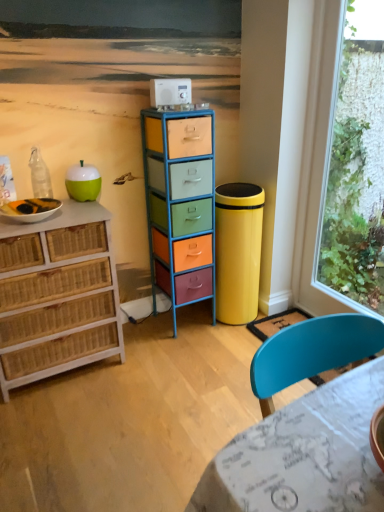
What is the approximate width of marble-patterned table at lower right?

marble-patterned table at lower right is 19.19 inches in width.

The image size is (384, 512). Describe the element at coordinates (303, 454) in the screenshot. I see `marble-patterned table at lower right` at that location.

What do you see at coordinates (180, 204) in the screenshot?
I see `metallic multicolored drawers at center, which is counted as the 2th chest of drawers, starting from the left` at bounding box center [180, 204].

This screenshot has width=384, height=512. Find the location of `transparent glass window at right`. transparent glass window at right is located at coordinates (346, 176).

Where is `green matte apple at left`? green matte apple at left is located at coordinates (83, 182).

The width and height of the screenshot is (384, 512). Identify the location of marble-patterned table at lower right. (303, 454).

Which of these two, metallic multicolored drawers at center, which is counted as the 2th chest of drawers, starting from the left, or marble-patterned table at lower right, stands shorter?

marble-patterned table at lower right.

Is metallic multicolored drawers at center, which is counted as the 2th chest of drawers, starting from the left, far from marble-patterned table at lower right?

metallic multicolored drawers at center, which is counted as the 2th chest of drawers, starting from the left, is far away from marble-patterned table at lower right.

Does metallic multicolored drawers at center, which is counted as the 2th chest of drawers, starting from the left, have a greater width compared to marble-patterned table at lower right?

In fact, metallic multicolored drawers at center, which is counted as the 2th chest of drawers, starting from the left, might be narrower than marble-patterned table at lower right.

From the image's perspective, is marble-patterned table at lower right located above woven wood chest of drawers at left, the 1th chest of drawers from the left?

No, from the image's perspective, marble-patterned table at lower right is not over woven wood chest of drawers at left, the 1th chest of drawers from the left.

Considering the sizes of objects marble-patterned table at lower right and woven wood chest of drawers at left, placed as the 2th chest of drawers when sorted from right to left, in the image provided, who is bigger, marble-patterned table at lower right or woven wood chest of drawers at left, placed as the 2th chest of drawers when sorted from right to left,?

Bigger between the two is woven wood chest of drawers at left, placed as the 2th chest of drawers when sorted from right to left.

Does marble-patterned table at lower right have a lesser width compared to woven wood chest of drawers at left, the 1th chest of drawers from the left?

Incorrect, the width of marble-patterned table at lower right is not less than that of woven wood chest of drawers at left, the 1th chest of drawers from the left.

You are a GUI agent. You are given a task and a screenshot of the screen. Output one action in this format:
    pyautogui.click(x=<x>, y=<y>)
    Task: Click on the 1st chest of drawers behind the marble-patterned table at lower right, counting from the anchor's position
    The height and width of the screenshot is (512, 384).
    Given the screenshot: What is the action you would take?
    pyautogui.click(x=57, y=295)

Is transparent glass window at right a part of white plastic appliance at upper center?

No, transparent glass window at right is not inside white plastic appliance at upper center.

Is white plastic appliance at upper center taller or shorter than transparent glass window at right?

white plastic appliance at upper center is shorter than transparent glass window at right.

Considering the positions of point (171, 91) and point (328, 242), is point (171, 91) closer or farther from the camera than point (328, 242)?

Point (171, 91) is closer to the camera than point (328, 242).

Between white plastic appliance at upper center and transparent glass window at right, which one has larger size?

transparent glass window at right.

Can you confirm if woven wood chest of drawers at left, the 1th chest of drawers from the left, is shorter than green matte apple at left?

No, woven wood chest of drawers at left, the 1th chest of drawers from the left, is not shorter than green matte apple at left.

Is point (47, 344) behind point (80, 174)?

No.

Considering the sizes of objects woven wood chest of drawers at left, the 1th chest of drawers from the left, and green matte apple at left in the image provided, who is smaller, woven wood chest of drawers at left, the 1th chest of drawers from the left, or green matte apple at left?

With smaller size is green matte apple at left.

From a real-world perspective, is woven wood chest of drawers at left, placed as the 2th chest of drawers when sorted from right to left, below green matte apple at left?

Indeed, from a real-world perspective, woven wood chest of drawers at left, placed as the 2th chest of drawers when sorted from right to left, is positioned beneath green matte apple at left.

From the image's perspective, is white plastic appliance at upper center located above woven wood chest of drawers at left, the 1th chest of drawers from the left?

Yes, from the image's perspective, white plastic appliance at upper center is above woven wood chest of drawers at left, the 1th chest of drawers from the left.

In the scene shown: Is woven wood chest of drawers at left, the 1th chest of drawers from the left, at the back of white plastic appliance at upper center?

No.

Is white plastic appliance at upper center inside the boundaries of woven wood chest of drawers at left, the 1th chest of drawers from the left, or outside?

white plastic appliance at upper center is located beyond the bounds of woven wood chest of drawers at left, the 1th chest of drawers from the left.

Identify the location of appliance on the right of the woven wood chest of drawers at left, placed as the 2th chest of drawers when sorted from right to left. pyautogui.click(x=170, y=92).

How many degrees apart are the facing directions of woven wood chest of drawers at left, placed as the 2th chest of drawers when sorted from right to left, and transparent glass window at right?

90.5 degrees separate the facing orientations of woven wood chest of drawers at left, placed as the 2th chest of drawers when sorted from right to left, and transparent glass window at right.

Can transparent glass window at right be found inside woven wood chest of drawers at left, placed as the 2th chest of drawers when sorted from right to left?

No, transparent glass window at right is not surrounded by woven wood chest of drawers at left, placed as the 2th chest of drawers when sorted from right to left.

Who is taller, woven wood chest of drawers at left, placed as the 2th chest of drawers when sorted from right to left, or transparent glass window at right?

transparent glass window at right is taller.

Is point (64, 255) farther from viewer compared to point (320, 141)?

No.

In the scene shown: Which object is wider, green matte apple at left or white matte bowl at left?

Wider between the two is white matte bowl at left.

In terms of height, does green matte apple at left look taller or shorter compared to white matte bowl at left?

In the image, green matte apple at left appears to be taller than white matte bowl at left.

Is green matte apple at left beside white matte bowl at left?

green matte apple at left and white matte bowl at left are clearly separated.

Between green matte apple at left and white matte bowl at left, which one appears on the left side from the viewer's perspective?

Positioned to the left is white matte bowl at left.

Identify the location of the 2nd chest of drawers behind the marble-patterned table at lower right. This screenshot has height=512, width=384. (180, 204).

Identify the location of the chest of drawers that is the 1st object above the marble-patterned table at lower right (from a real-world perspective). The image size is (384, 512). (57, 295).

From the image, which object appears to be farther from metallic multicolored drawers at center, which is counted as the 2th chest of drawers, starting from the left, marble-patterned table at lower right or white matte bowl at left?

Based on the image, marble-patterned table at lower right appears to be further to metallic multicolored drawers at center, which is counted as the 2th chest of drawers, starting from the left.

From the image, which object appears to be farther from white matte bowl at left, marble-patterned table at lower right or white plastic appliance at upper center?

Based on the image, marble-patterned table at lower right appears to be further to white matte bowl at left.

Considering their positions, is marble-patterned table at lower right positioned closer to woven wood chest of drawers at left, the 1th chest of drawers from the left, than white plastic appliance at upper center?

white plastic appliance at upper center.

Consider the image. When comparing their distances from transparent glass window at right, does woven wood chest of drawers at left, the 1th chest of drawers from the left, or white matte bowl at left seem closer?

woven wood chest of drawers at left, the 1th chest of drawers from the left, is positioned closer to the anchor transparent glass window at right.

Considering their positions, is white matte bowl at left positioned further to woven wood chest of drawers at left, the 1th chest of drawers from the left, than marble-patterned table at lower right?

marble-patterned table at lower right is further to woven wood chest of drawers at left, the 1th chest of drawers from the left.

Considering their positions, is transparent glass window at right positioned further to metallic multicolored drawers at center, placed as the 1th chest of drawers when sorted from right to left, than white plastic appliance at upper center?

Among the two, transparent glass window at right is located further to metallic multicolored drawers at center, placed as the 1th chest of drawers when sorted from right to left.

From the picture: Estimate the real-world distances between objects in this image. Which object is closer to woven wood chest of drawers at left, the 1th chest of drawers from the left, white plastic appliance at upper center or white matte bowl at left?

white matte bowl at left is positioned closer to the anchor woven wood chest of drawers at left, the 1th chest of drawers from the left.

From the image, which object appears to be farther from metallic multicolored drawers at center, which is counted as the 2th chest of drawers, starting from the left, transparent glass window at right or woven wood chest of drawers at left, placed as the 2th chest of drawers when sorted from right to left?

transparent glass window at right is further to metallic multicolored drawers at center, which is counted as the 2th chest of drawers, starting from the left.

Where is `bowl between white plastic appliance at upper center and metallic multicolored drawers at center, which is counted as the 2th chest of drawers, starting from the left, in the up-down direction`? This screenshot has width=384, height=512. bowl between white plastic appliance at upper center and metallic multicolored drawers at center, which is counted as the 2th chest of drawers, starting from the left, in the up-down direction is located at coordinates (30, 209).

Find the location of a particular element. The width and height of the screenshot is (384, 512). teal between white plastic appliance at upper center and metallic multicolored drawers at center, placed as the 1th chest of drawers when sorted from right to left, in the up-down direction is located at coordinates (83, 182).

The image size is (384, 512). In order to click on bowl between marble-patterned table at lower right and green matte apple at left in the front-back direction in this screenshot , I will do `click(30, 209)`.

The height and width of the screenshot is (512, 384). Find the location of `teal between white plastic appliance at upper center and woven wood chest of drawers at left, placed as the 2th chest of drawers when sorted from right to left, from top to bottom`. teal between white plastic appliance at upper center and woven wood chest of drawers at left, placed as the 2th chest of drawers when sorted from right to left, from top to bottom is located at coordinates (83, 182).